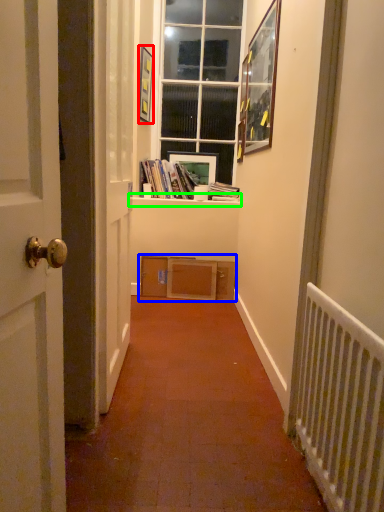
Question: Estimate the real-world distances between objects in this image. Which object is closer to picture frame (highlighted by a red box), shelf (highlighted by a blue box) or window sill (highlighted by a green box)?

Choices:
 (A) shelf
 (B) window sill

Answer: (B)